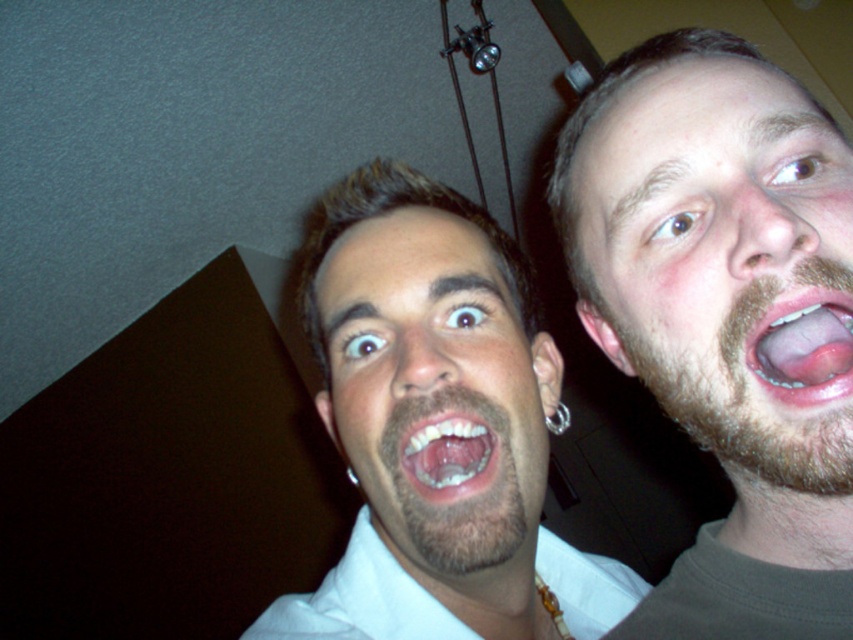
Question: Which point is farther to the camera?

Choices:
 (A) pink glossy tongue at center
 (B) white glossy teeth at center
 (C) brownhairman at center

Answer: (B)

Question: Among these objects, which one is nearest to the camera?

Choices:
 (A) brownhairman at center
 (B) beige facial hair at upper right

Answer: (B)

Question: From the image, what is the correct spatial relationship of brownhairman at center in relation to pink glossy tongue at center?

Choices:
 (A) right
 (B) left

Answer: (B)

Question: Can you confirm if beige facial hair at upper right is smaller than pink glossy tongue at center?

Choices:
 (A) no
 (B) yes

Answer: (A)

Question: Is brownhairman at center above white glossy teeth at center?

Choices:
 (A) no
 (B) yes

Answer: (B)

Question: Which point is closer to the camera taking this photo?

Choices:
 (A) (492, 448)
 (B) (689, 150)
 (C) (463, 496)

Answer: (B)